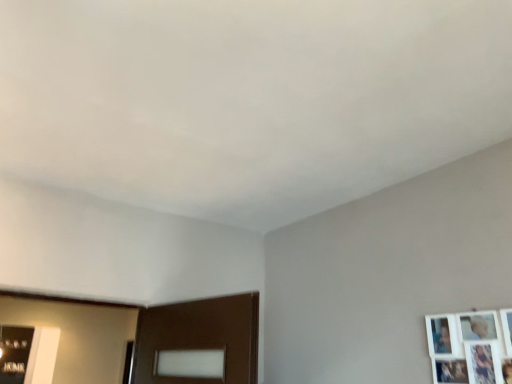
Question: Is metallic silver picture frame at lower left, which is the first picture frame in left-to-right order, positioned before white matte picture frame at upper right, which ranks as the second picture frame in left-to-right order?

Choices:
 (A) yes
 (B) no

Answer: (B)

Question: Can you confirm if metallic silver picture frame at lower left, which appears as the second picture frame when viewed from the right, is bigger than white matte picture frame at upper right, positioned as the first picture frame in front-to-back order?

Choices:
 (A) yes
 (B) no

Answer: (A)

Question: From the image's perspective, is metallic silver picture frame at lower left, marked as the second picture frame in a front-to-back arrangement, located beneath white matte picture frame at upper right, which ranks as the first picture frame in right-to-left order?

Choices:
 (A) yes
 (B) no

Answer: (A)

Question: Is the depth of metallic silver picture frame at lower left, arranged as the second picture frame when viewed from the top, greater than that of white matte picture frame at upper right, which is the first picture frame in top-to-bottom order?

Choices:
 (A) no
 (B) yes

Answer: (B)

Question: Is metallic silver picture frame at lower left, which is the first picture frame in bottom-to-top order, thinner than white matte picture frame at upper right, which is the first picture frame in top-to-bottom order?

Choices:
 (A) no
 (B) yes

Answer: (A)

Question: From a real-world perspective, is metallic silver picture frame at lower left, which is the first picture frame from back to front, physically above white matte picture frame at upper right, which is the first picture frame in top-to-bottom order?

Choices:
 (A) no
 (B) yes

Answer: (B)

Question: Does white matte picture frame at upper right, positioned as the first picture frame in front-to-back order, have a larger size compared to metallic silver picture frame at lower left, marked as the second picture frame in a front-to-back arrangement?

Choices:
 (A) no
 (B) yes

Answer: (A)

Question: Is there a large distance between white matte picture frame at upper right, which ranks as the first picture frame in right-to-left order, and metallic silver picture frame at lower left, marked as the second picture frame in a front-to-back arrangement?

Choices:
 (A) no
 (B) yes

Answer: (B)

Question: Is white matte picture frame at upper right, which ranks as the second picture frame in back-to-front order, oriented away from metallic silver picture frame at lower left, which is the first picture frame in left-to-right order?

Choices:
 (A) no
 (B) yes

Answer: (A)

Question: Is white matte picture frame at upper right, which is the first picture frame in top-to-bottom order, smaller than metallic silver picture frame at lower left, marked as the second picture frame in a front-to-back arrangement?

Choices:
 (A) no
 (B) yes

Answer: (B)

Question: From a real-world perspective, does white matte picture frame at upper right, positioned as the first picture frame in front-to-back order, sit lower than metallic silver picture frame at lower left, marked as the second picture frame in a front-to-back arrangement?

Choices:
 (A) no
 (B) yes

Answer: (B)

Question: Considering the relative positions of white matte picture frame at upper right, positioned as the first picture frame in front-to-back order, and metallic silver picture frame at lower left, which is the first picture frame in left-to-right order, in the image provided, is white matte picture frame at upper right, positioned as the first picture frame in front-to-back order, to the right of metallic silver picture frame at lower left, which is the first picture frame in left-to-right order, from the viewer's perspective?

Choices:
 (A) no
 (B) yes

Answer: (B)

Question: Would you say metallic silver picture frame at lower left, which is the first picture frame in left-to-right order, is to the left or to the right of white matte picture frame at upper right, which ranks as the second picture frame in back-to-front order, in the picture?

Choices:
 (A) right
 (B) left

Answer: (B)